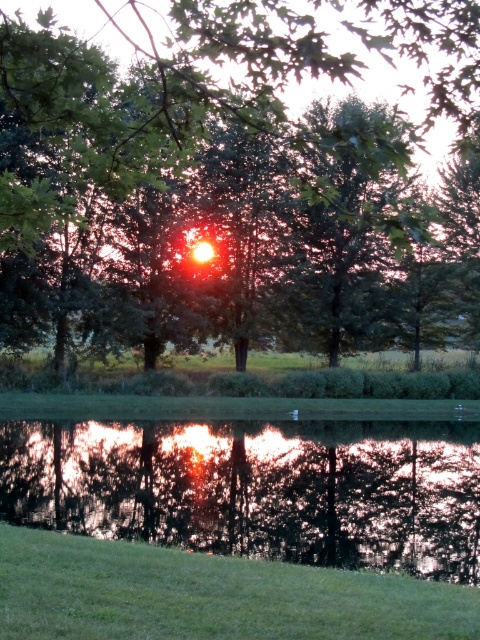
Question: Which point is farther to the camera?

Choices:
 (A) (23, 336)
 (B) (453, 516)

Answer: (A)

Question: Considering the relative positions of green leafy tree at center and reflective glass water at center in the image provided, where is green leafy tree at center located with respect to reflective glass water at center?

Choices:
 (A) left
 (B) right

Answer: (B)

Question: Which point is farther from the camera taking this photo?

Choices:
 (A) pos(470,481)
 (B) pos(361,109)

Answer: (B)

Question: Can you confirm if green leafy tree at center is positioned below reflective glass water at center?

Choices:
 (A) yes
 (B) no

Answer: (B)

Question: Is green leafy tree at center positioned in front of reflective glass water at center?

Choices:
 (A) yes
 (B) no

Answer: (A)